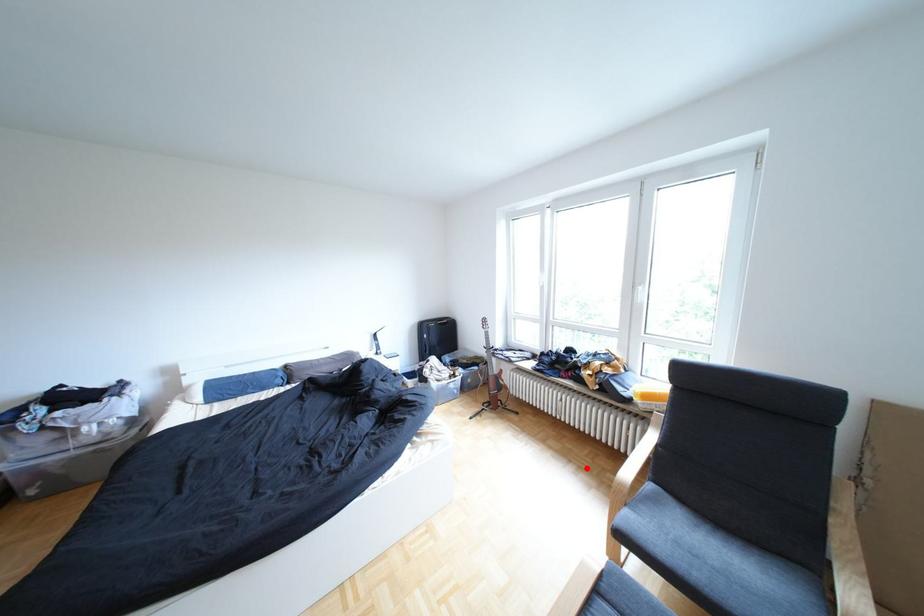
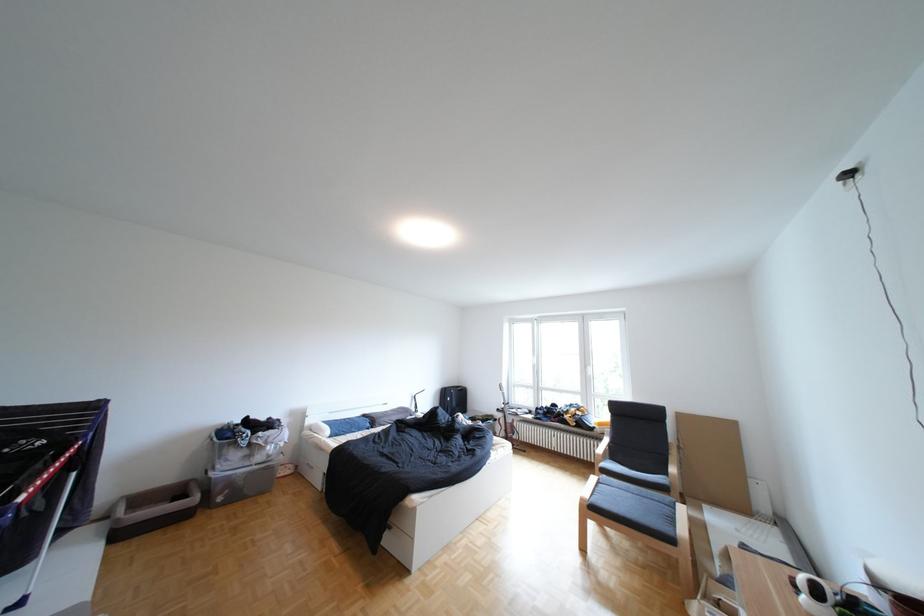
Where in the second image is the point corresponding to the highlighted location from the first image?

(584, 474)